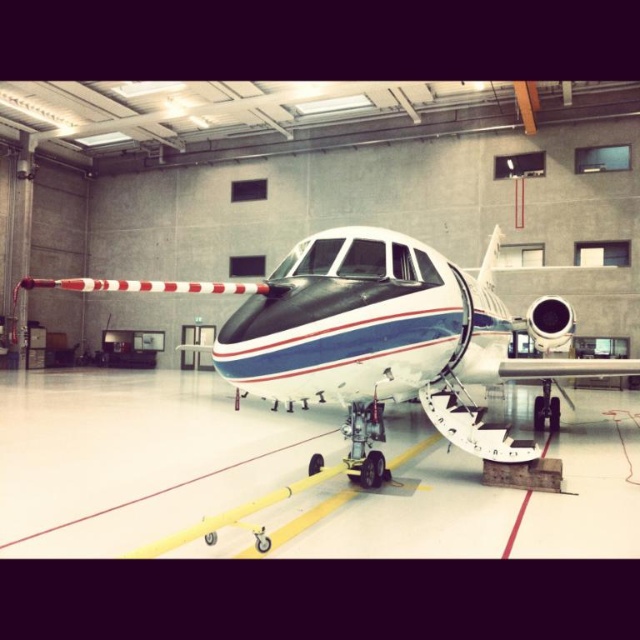
You are a pilot who needs to ensure the white glossy tarmac at center can accommodate the white glossy airplane at center. Based on the scene, can the airplane fit on the tarmac?

The white glossy tarmac at center is smaller than the white glossy airplane at center, so the airplane cannot fit on the tarmac.

You are standing at the entrance of the hangar and see two points marked on the floor. The first point is labeled as point (582, 449) and the second is point (294, 275). If you want to move from the entrance to the point that is further away from you, which point should you go to?

Point (582, 449) is behind point (294, 275), so you should go to point (582, 449) as it is further away from the entrance.

You are a pilot trying to align your private jet with the yellow lines on the hangar floor. Based on the image, where is the white glossy tarmac at center in relation to the yellow lines?

The white glossy tarmac at center is located at point coordinates (138,456), which would be the central area of the hangar floor. Since the yellow lines are likely marking parking zones, the white tarmac area is probably positioned centrally between these lines for aircraft alignment.